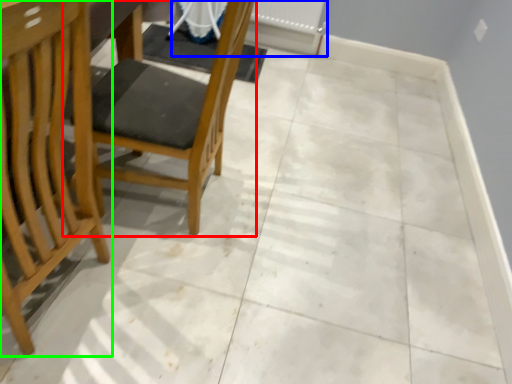
Question: Which is nearer to the chair (highlighted by a red box)? radiator (highlighted by a blue box) or chair (highlighted by a green box).

Choices:
 (A) radiator
 (B) chair

Answer: (B)